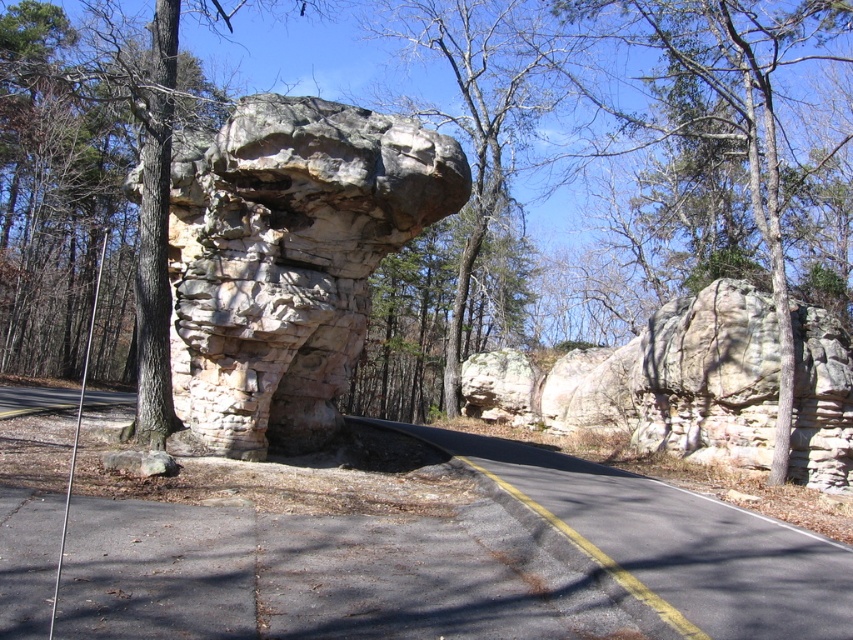
Is point (325, 218) behind point (468, 358)?

No, (325, 218) is closer to viewer.

Between point (360, 324) and point (460, 372), which one is positioned in front?

Point (360, 324) is more forward.

Where is `gray stone arch at center`? This screenshot has width=853, height=640. gray stone arch at center is located at coordinates (288, 259).

Find the location of a particular element. The image size is (853, 640). gray stone arch at center is located at coordinates (288, 259).